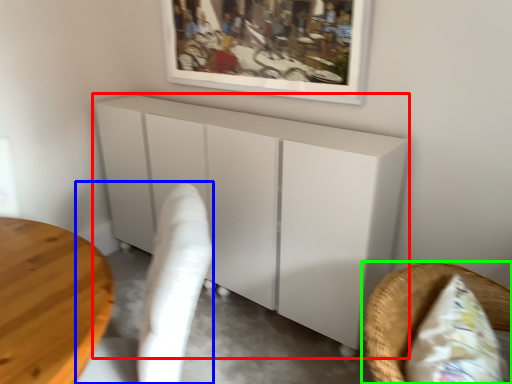
Question: Estimate the real-world distances between objects in this image. Which object is farther from furniture (highlighted by a red box), swivel chair (highlighted by a blue box) or furniture (highlighted by a green box)?

Choices:
 (A) swivel chair
 (B) furniture

Answer: (B)